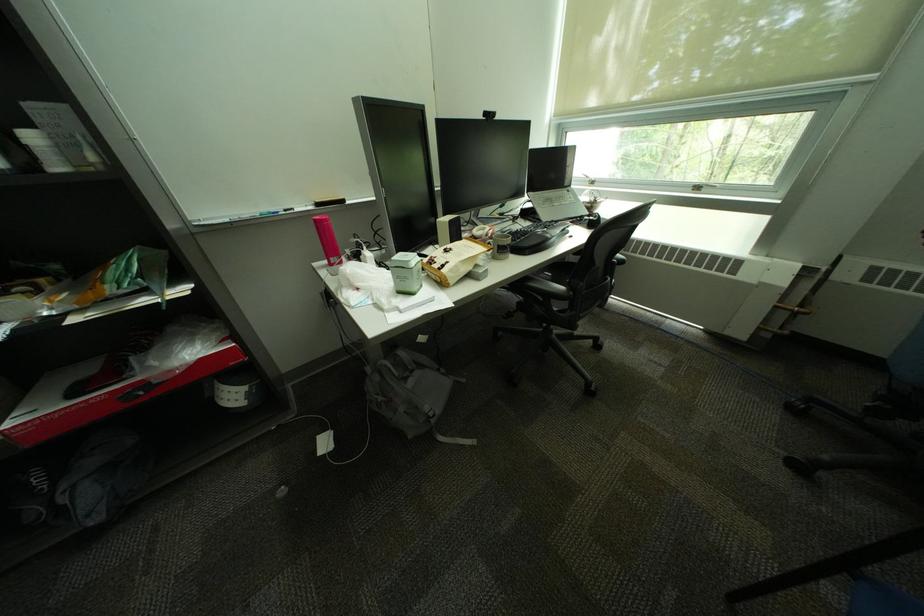
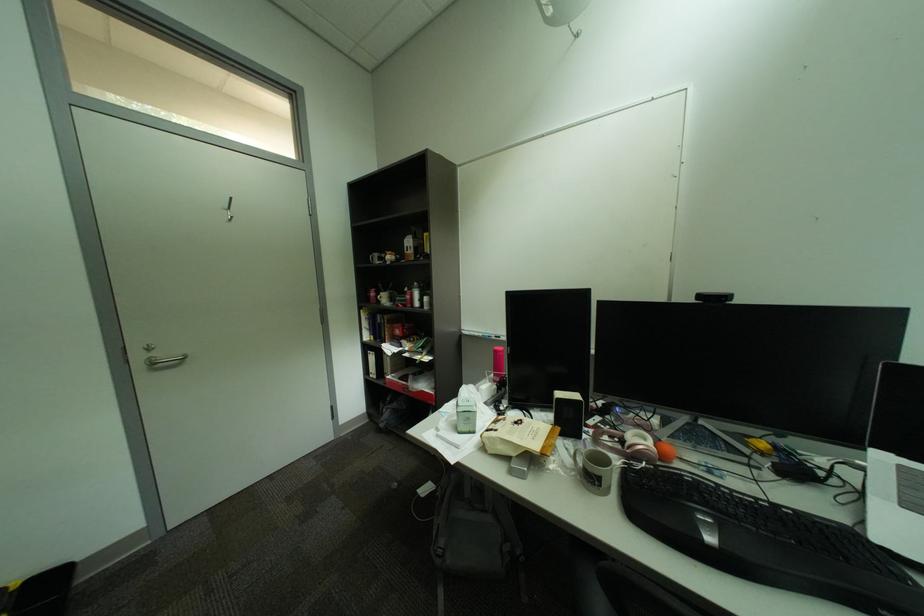
Question: How did the camera likely rotate?

Choices:
 (A) Left
 (B) Right
 (C) Up
 (D) Down

Answer: (A)